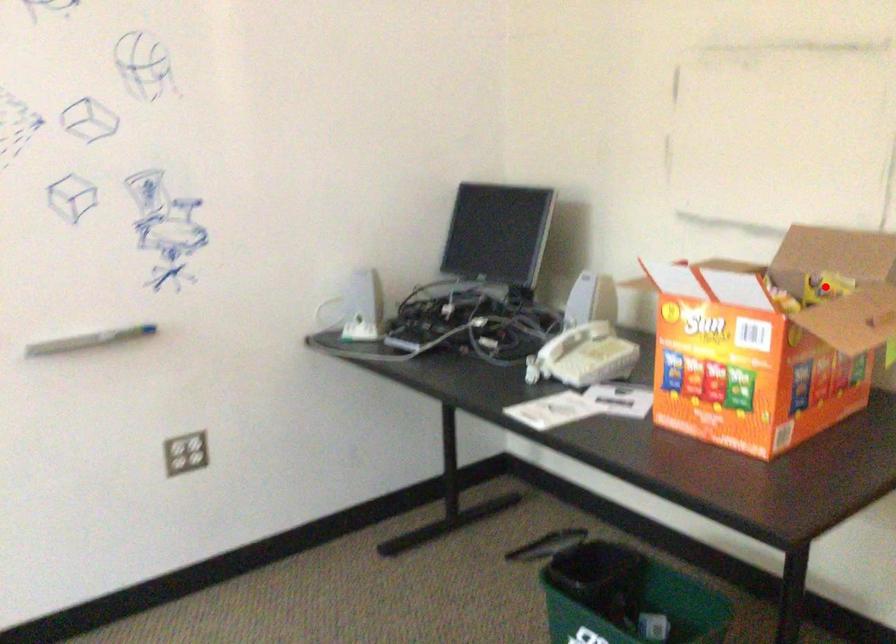
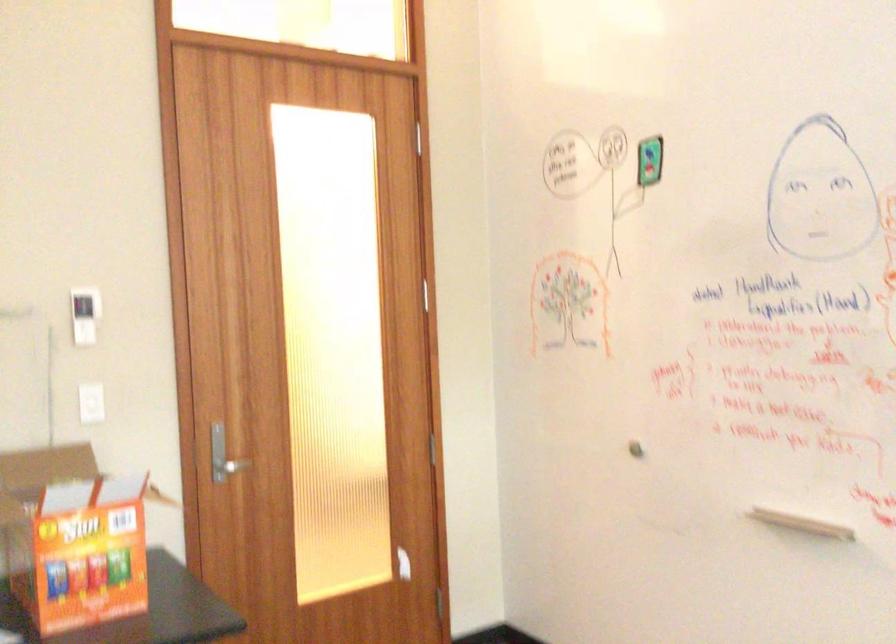
Question: I am providing you with two images of the same scene from different viewpoints. A red point is marked on the first image. At the location where the point appears in image 1, is it still visible in image 2?

Choices:
 (A) Yes
 (B) No

Answer: (B)